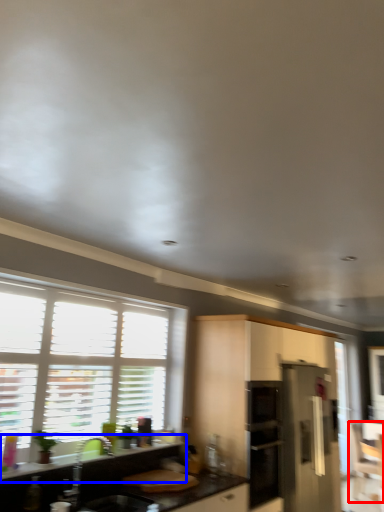
Question: Which object appears closest to the camera in this image, armchair (highlighted by a red box) or countertop (highlighted by a blue box)?

Choices:
 (A) armchair
 (B) countertop

Answer: (B)